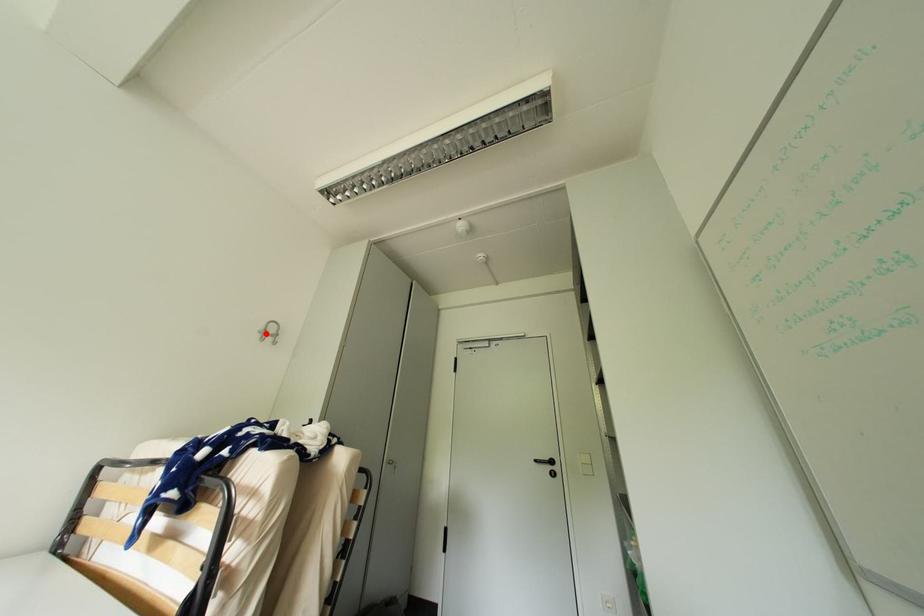
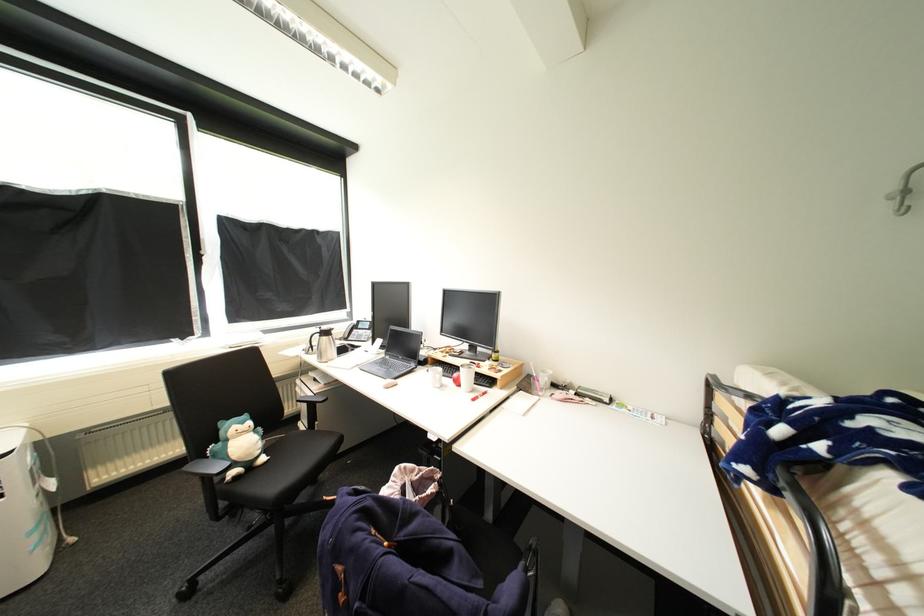
Locate, in the second image, the point that corresponds to the highlighted location in the first image.

(900, 199)